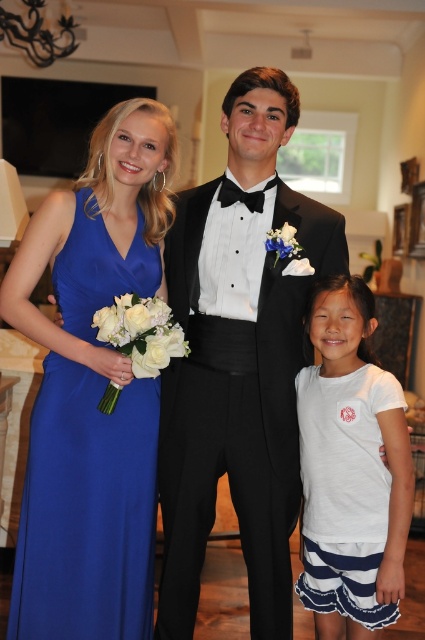
Is black satin tuxedo at center taller than royal blue satin dress at left?

Indeed, black satin tuxedo at center has a greater height compared to royal blue satin dress at left.

Who is higher up, black satin tuxedo at center or royal blue satin dress at left?

black satin tuxedo at center is higher up.

The height and width of the screenshot is (640, 425). What do you see at coordinates (238, 364) in the screenshot? I see `black satin tuxedo at center` at bounding box center [238, 364].

In order to click on black satin tuxedo at center in this screenshot , I will do `click(238, 364)`.

Looking at this image, can you confirm if black satin tuxedo at center is positioned below white cotton shirt at center?

Actually, black satin tuxedo at center is above white cotton shirt at center.

At what (x,y) coordinates should I click in order to perform the action: click on black satin tuxedo at center. Please return your answer as a coordinate pair (x, y). Looking at the image, I should click on (238, 364).

Is black satin tuxedo at center positioned in front of black satin bow tie at center?

Yes, it is.

Between point (224, 452) and point (221, 204), which one is positioned behind?

The point (221, 204) is more distant.

Where is `black satin tuxedo at center`? This screenshot has width=425, height=640. black satin tuxedo at center is located at coordinates (238, 364).